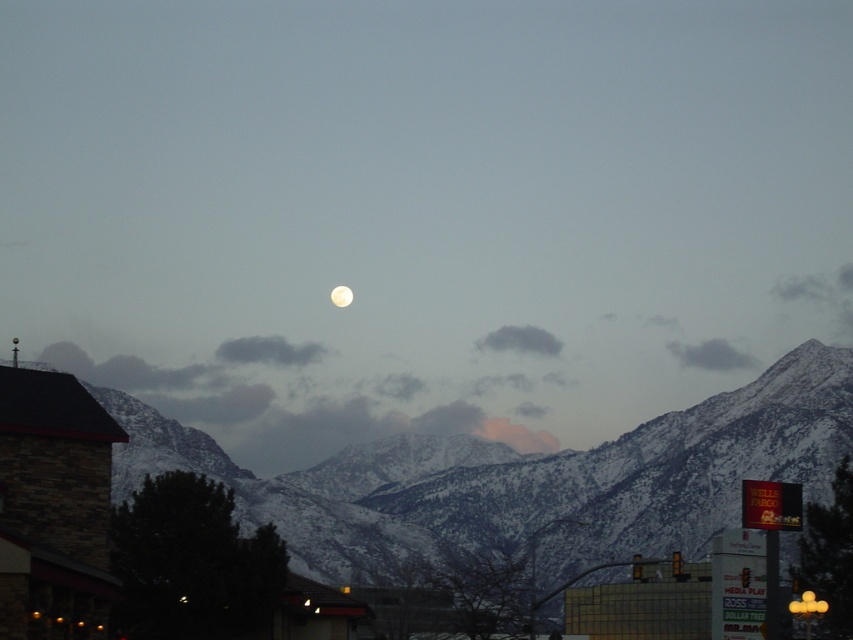
Question: Does snowy mountain range at center have a smaller size compared to white glossy moon at upper center?

Choices:
 (A) no
 (B) yes

Answer: (A)

Question: Is snowy mountain range at center above white glossy moon at upper center?

Choices:
 (A) no
 (B) yes

Answer: (A)

Question: Which of the following is the closest to the observer?

Choices:
 (A) (316, 525)
 (B) (341, 301)

Answer: (A)

Question: Does snowy mountain range at center have a greater width compared to white glossy moon at upper center?

Choices:
 (A) yes
 (B) no

Answer: (A)